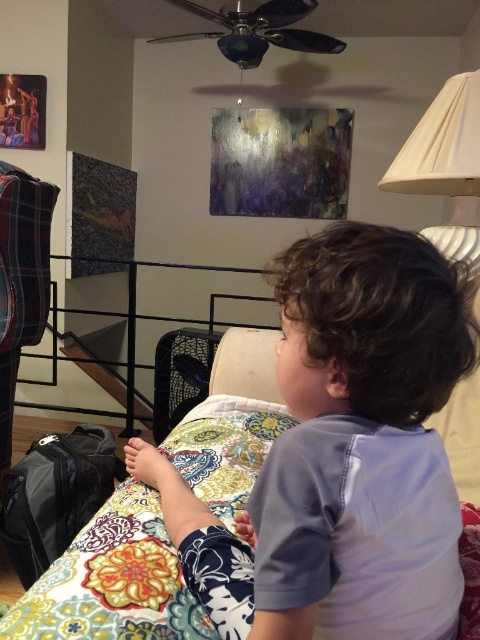
Question: Can you confirm if floral patchwork quilt at lower center is positioned below black fabric suitcase at lower left?

Choices:
 (A) no
 (B) yes

Answer: (A)

Question: Which point appears farthest from the camera in this image?

Choices:
 (A) click(23, 609)
 (B) click(352, 529)

Answer: (A)

Question: Considering the relative positions of black fabric suitcase at lower left and white pleated lampshade at upper right in the image provided, where is black fabric suitcase at lower left located with respect to white pleated lampshade at upper right?

Choices:
 (A) right
 (B) left

Answer: (B)

Question: Which point is closer to the camera?

Choices:
 (A) (220, 497)
 (B) (282, 339)
 (C) (51, 528)

Answer: (B)

Question: Considering the relative positions of floral patchwork quilt at lower center and black fabric suitcase at lower left in the image provided, where is floral patchwork quilt at lower center located with respect to black fabric suitcase at lower left?

Choices:
 (A) above
 (B) below

Answer: (A)

Question: Which point is farther from the camera taking this photo?

Choices:
 (A) (175, 538)
 (B) (467, 218)
 (C) (58, 624)
 (D) (84, 515)

Answer: (D)